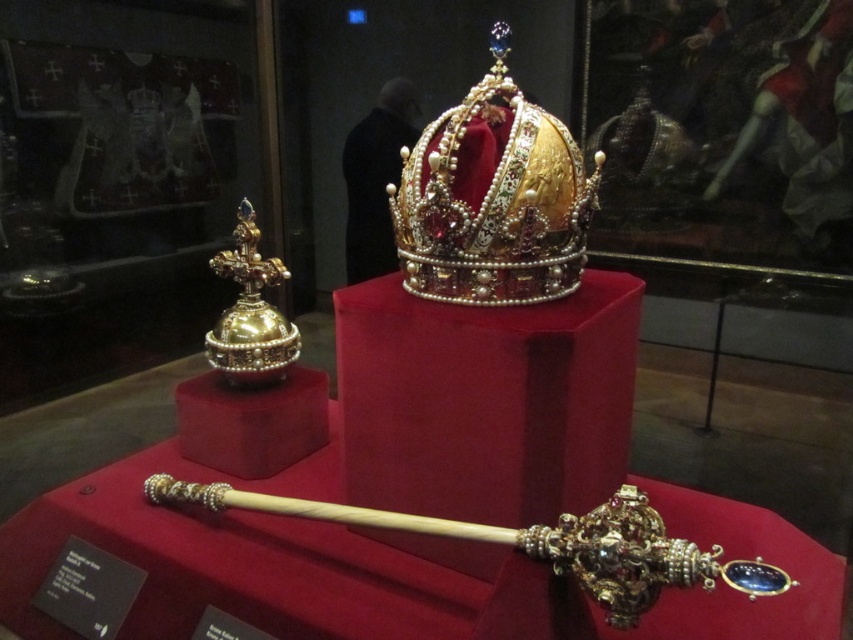
You are a museum curator planning to place a protective glass cover over the gold jeweled crown at center and the gold polished cross at left. The glass cover must be wide enough to accommodate both items. Based on their widths, will a single glass cover spanning 1.2 meters in width suffice?

The gold jeweled crown at center is wider than the gold polished cross at left. Since the crown is wider, the glass cover must be at least as wide as the crown. However, the description only states the crown is wider, but does not provide exact measurements. Without knowing the exact width of the crown, it is impossible to determine if 1.2 meters is sufficient. Additional measurements are needed to ensure proper coverage.

You are a museum curator planning to install a protective glass case that must accommodate both the gold jeweled crown at center and the gold polished cross at left. Given that the crown is much taller than the cross, what should be the minimum height of the glass case to ensure both items are fully enclosed?

The gold jeweled crown at center is much taller than the gold polished cross at left, so the minimum height of the glass case should be based on the height of the gold jeweled crown at center to ensure both items are fully enclosed.

You are a museum curator arranging a new exhibit. You have to place a large display case in front of the gold jeweled crown at center and the gold polished cross at left. The display case must not block the view of either artifact. Which artifact should the display case be placed closer to, and why?

The display case should be placed closer to the gold polished cross at left because the gold jeweled crown at center is positioned over it, meaning the cross is lower or behind the crown. Placing the case closer to the cross would ensure both artifacts remain visible without obstruction.